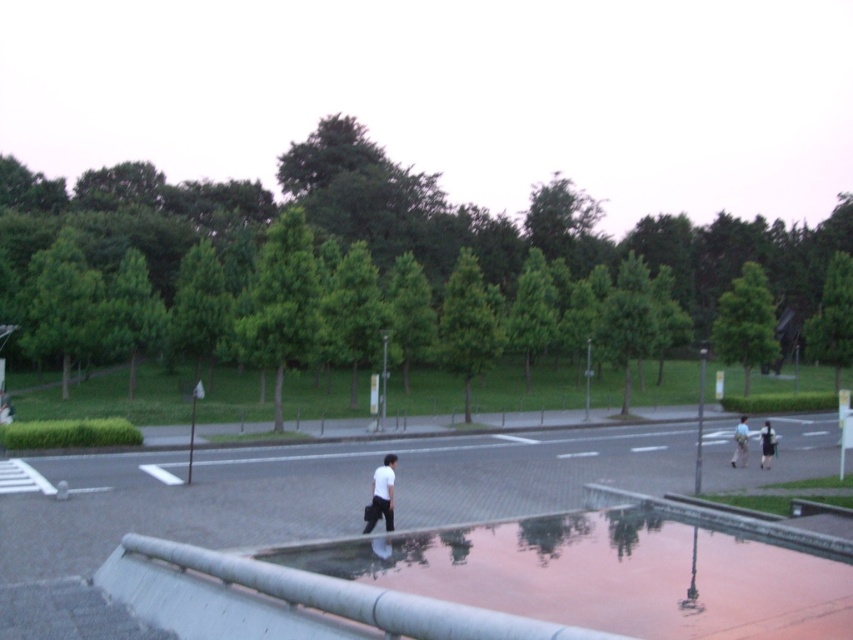
You are standing at the point with coordinates point (762, 444) and want to walk towards the point with coordinates point (741, 461). Given that there is a reflective water feature in the foreground, will you be able to see the water feature while walking towards your destination?

Since point (741, 461) is behind point (762, 444), walking towards point (741, 461) means you are moving away from the reflective water feature in the foreground. Therefore, you will not be able to see the water feature while walking towards your destination.